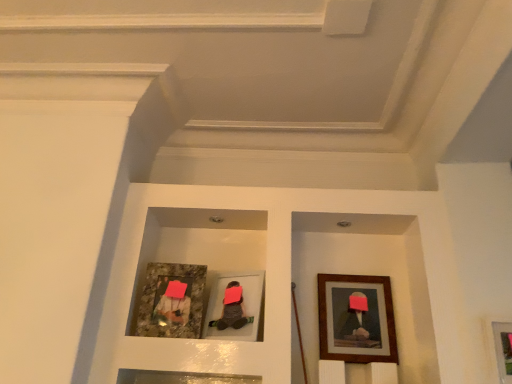
You are a GUI agent. You are given a task and a screenshot of the screen. Output one action in this format:
    pyautogui.click(x=<x>, y=<y>)
    Task: Click on the wooden framed artwork at right, the 3th picture frame in the left-to-right sequence
    The width and height of the screenshot is (512, 384).
    Given the screenshot: What is the action you would take?
    pyautogui.click(x=356, y=319)

Image resolution: width=512 pixels, height=384 pixels. I want to click on matte gray picture frame at center, the third picture frame from the right, so click(x=243, y=306).

Identify the location of wooden framed picture at lower right, the 4th picture frame from the left. The image size is (512, 384). (503, 349).

How different are the orientations of granite-like frame at left, placed as the fourth picture frame when sorted from right to left, and wooden framed artwork at right, which is the 2th picture frame in right-to-left order, in degrees?

granite-like frame at left, placed as the fourth picture frame when sorted from right to left, and wooden framed artwork at right, which is the 2th picture frame in right-to-left order, are facing 7.33 degrees away from each other.

Who is smaller, granite-like frame at left, placed as the fourth picture frame when sorted from right to left, or wooden framed artwork at right, which is the 2th picture frame in right-to-left order?

granite-like frame at left, placed as the fourth picture frame when sorted from right to left, is smaller.

Between granite-like frame at left, arranged as the 1th picture frame when viewed from the left, and wooden framed artwork at right, which is the 2th picture frame in right-to-left order, which one has larger width?

With larger width is granite-like frame at left, arranged as the 1th picture frame when viewed from the left.

Considering the relative positions of wooden framed artwork at right, which is the 2th picture frame in right-to-left order, and matte gray picture frame at center, positioned as the second picture frame in left-to-right order, in the image provided, is wooden framed artwork at right, which is the 2th picture frame in right-to-left order, to the left of matte gray picture frame at center, positioned as the second picture frame in left-to-right order, from the viewer's perspective?

In fact, wooden framed artwork at right, which is the 2th picture frame in right-to-left order, is to the right of matte gray picture frame at center, positioned as the second picture frame in left-to-right order.

Does point (378, 314) appear closer or farther from the camera than point (229, 327)?

Point (378, 314) appears to be farther away from the viewer than point (229, 327).

How distant is wooden framed artwork at right, which is the 2th picture frame in right-to-left order, from matte gray picture frame at center, positioned as the second picture frame in left-to-right order?

They are 16.79 inches apart.

Is wooden framed artwork at right, which is the 2th picture frame in right-to-left order, smaller than matte gray picture frame at center, the third picture frame from the right?

Indeed, wooden framed artwork at right, which is the 2th picture frame in right-to-left order, has a smaller size compared to matte gray picture frame at center, the third picture frame from the right.

Is wooden framed artwork at right, the 3th picture frame in the left-to-right sequence, oriented towards granite-like frame at left, placed as the fourth picture frame when sorted from right to left?

No, wooden framed artwork at right, the 3th picture frame in the left-to-right sequence, is not aimed at granite-like frame at left, placed as the fourth picture frame when sorted from right to left.

In the scene shown: Is wooden framed artwork at right, the 3th picture frame in the left-to-right sequence, to the left of granite-like frame at left, placed as the fourth picture frame when sorted from right to left, from the viewer's perspective?

In fact, wooden framed artwork at right, the 3th picture frame in the left-to-right sequence, is to the right of granite-like frame at left, placed as the fourth picture frame when sorted from right to left.

Considering the positions of points (337, 348) and (162, 305), is point (337, 348) farther from camera compared to point (162, 305)?

That is True.

In terms of height, does wooden framed artwork at right, the 3th picture frame in the left-to-right sequence, look taller or shorter compared to granite-like frame at left, placed as the fourth picture frame when sorted from right to left?

In the image, wooden framed artwork at right, the 3th picture frame in the left-to-right sequence, appears to be taller than granite-like frame at left, placed as the fourth picture frame when sorted from right to left.

Which is less distant, [384,282] or [507,359]?

The point [507,359] is in front.

Is wooden framed artwork at right, the 3th picture frame in the left-to-right sequence, positioned with its back to wooden framed picture at lower right, the 4th picture frame from the left?

No, wooden framed artwork at right, the 3th picture frame in the left-to-right sequence, is not facing the opposite direction of wooden framed picture at lower right, the 4th picture frame from the left.

From a real-world perspective, is wooden framed artwork at right, the 3th picture frame in the left-to-right sequence, physically located above or below wooden framed picture at lower right, the 4th picture frame from the left?

wooden framed artwork at right, the 3th picture frame in the left-to-right sequence, is above wooden framed picture at lower right, the 4th picture frame from the left.

Can you confirm if wooden framed artwork at right, which is the 2th picture frame in right-to-left order, is positioned to the right of wooden framed picture at lower right, which is the 1th picture frame from right to left?

Incorrect, wooden framed artwork at right, which is the 2th picture frame in right-to-left order, is not on the right side of wooden framed picture at lower right, which is the 1th picture frame from right to left.

Between point (231, 280) and point (383, 332), which one is positioned in front?

The point (383, 332) is more forward.

Does matte gray picture frame at center, the third picture frame from the right, touch wooden framed artwork at right, which is the 2th picture frame in right-to-left order?

No, matte gray picture frame at center, the third picture frame from the right, is not touching wooden framed artwork at right, which is the 2th picture frame in right-to-left order.

What's the angular difference between matte gray picture frame at center, positioned as the second picture frame in left-to-right order, and wooden framed artwork at right, the 3th picture frame in the left-to-right sequence,'s facing directions?

The angular difference between matte gray picture frame at center, positioned as the second picture frame in left-to-right order, and wooden framed artwork at right, the 3th picture frame in the left-to-right sequence, is 23.4 degrees.

From the image's perspective, starting from the wooden framed artwork at right, the 3th picture frame in the left-to-right sequence, which picture frame is the 1st one above? Please provide its 2D coordinates.

[(243, 306)]

Consider the image. From a real-world perspective, does wooden framed picture at lower right, the 4th picture frame from the left, sit lower than wooden framed artwork at right, which is the 2th picture frame in right-to-left order?

Correct, in the physical world, wooden framed picture at lower right, the 4th picture frame from the left, is lower than wooden framed artwork at right, which is the 2th picture frame in right-to-left order.

Does wooden framed picture at lower right, which is the 1th picture frame from right to left, turn towards wooden framed artwork at right, which is the 2th picture frame in right-to-left order?

No.

Is the surface of wooden framed picture at lower right, the 4th picture frame from the left, in direct contact with wooden framed artwork at right, the 3th picture frame in the left-to-right sequence?

No, wooden framed picture at lower right, the 4th picture frame from the left, is not with wooden framed artwork at right, the 3th picture frame in the left-to-right sequence.

Are granite-like frame at left, arranged as the 1th picture frame when viewed from the left, and matte gray picture frame at center, the third picture frame from the right, making contact?

There is a gap between granite-like frame at left, arranged as the 1th picture frame when viewed from the left, and matte gray picture frame at center, the third picture frame from the right.

Which is farther, (184,310) or (213,300)?

The point (213,300) is more distant.

I want to click on the 2nd picture frame below when counting from the granite-like frame at left, placed as the fourth picture frame when sorted from right to left (from the image's perspective), so click(356, 319).

Identify the location of the 1st picture frame above the matte gray picture frame at center, the third picture frame from the right (from a real-world perspective). (356, 319).

Looking at the image, which one is located further to matte gray picture frame at center, the third picture frame from the right, wooden framed picture at lower right, the 4th picture frame from the left, or granite-like frame at left, arranged as the 1th picture frame when viewed from the left?

Based on the image, wooden framed picture at lower right, the 4th picture frame from the left, appears to be further to matte gray picture frame at center, the third picture frame from the right.

Considering their positions, is wooden framed artwork at right, which is the 2th picture frame in right-to-left order, positioned closer to wooden framed picture at lower right, which is the 1th picture frame from right to left, than granite-like frame at left, placed as the fourth picture frame when sorted from right to left?

Answer: The object closer to wooden framed picture at lower right, which is the 1th picture frame from right to left, is wooden framed artwork at right, which is the 2th picture frame in right-to-left order.

Based on their spatial positions, is wooden framed artwork at right, which is the 2th picture frame in right-to-left order, or wooden framed picture at lower right, the 4th picture frame from the left, closer to granite-like frame at left, placed as the fourth picture frame when sorted from right to left?

wooden framed artwork at right, which is the 2th picture frame in right-to-left order.

Considering their positions, is matte gray picture frame at center, the third picture frame from the right, positioned further to wooden framed picture at lower right, which is the 1th picture frame from right to left, than granite-like frame at left, arranged as the 1th picture frame when viewed from the left?

granite-like frame at left, arranged as the 1th picture frame when viewed from the left.

Based on the photo, when comparing their distances from matte gray picture frame at center, the third picture frame from the right, does wooden framed artwork at right, the 3th picture frame in the left-to-right sequence, or granite-like frame at left, arranged as the 1th picture frame when viewed from the left, seem closer?

Based on the image, granite-like frame at left, arranged as the 1th picture frame when viewed from the left, appears to be nearer to matte gray picture frame at center, the third picture frame from the right.

Looking at the image, which one is located further to wooden framed picture at lower right, which is the 1th picture frame from right to left, granite-like frame at left, arranged as the 1th picture frame when viewed from the left, or wooden framed artwork at right, the 3th picture frame in the left-to-right sequence?

Based on the image, granite-like frame at left, arranged as the 1th picture frame when viewed from the left, appears to be further to wooden framed picture at lower right, which is the 1th picture frame from right to left.

Consider the image. Considering their positions, is granite-like frame at left, placed as the fourth picture frame when sorted from right to left, positioned further to matte gray picture frame at center, the third picture frame from the right, than wooden framed artwork at right, which is the 2th picture frame in right-to-left order?

Among the two, wooden framed artwork at right, which is the 2th picture frame in right-to-left order, is located further to matte gray picture frame at center, the third picture frame from the right.

Based on their spatial positions, is granite-like frame at left, arranged as the 1th picture frame when viewed from the left, or wooden framed picture at lower right, which is the 1th picture frame from right to left, closer to wooden framed artwork at right, which is the 2th picture frame in right-to-left order?

wooden framed picture at lower right, which is the 1th picture frame from right to left, is closer to wooden framed artwork at right, which is the 2th picture frame in right-to-left order.

Where is `picture frame situated between granite-like frame at left, placed as the fourth picture frame when sorted from right to left, and wooden framed artwork at right, the 3th picture frame in the left-to-right sequence, from left to right`? picture frame situated between granite-like frame at left, placed as the fourth picture frame when sorted from right to left, and wooden framed artwork at right, the 3th picture frame in the left-to-right sequence, from left to right is located at coordinates (243, 306).

The height and width of the screenshot is (384, 512). In order to click on picture frame located between matte gray picture frame at center, the third picture frame from the right, and wooden framed picture at lower right, the 4th picture frame from the left, in the left-right direction in this screenshot , I will do `click(356, 319)`.